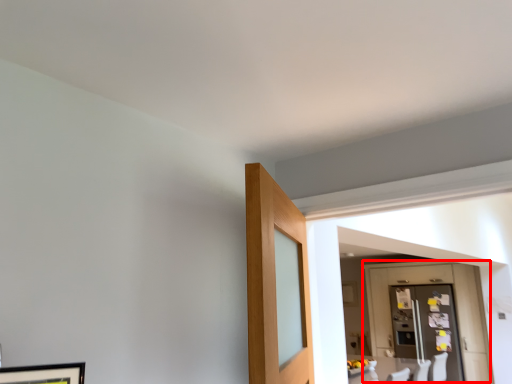
Question: From the image, what is the correct spatial relationship of door (annotated by the red box) in relation to glass door?

Choices:
 (A) left
 (B) right

Answer: (A)